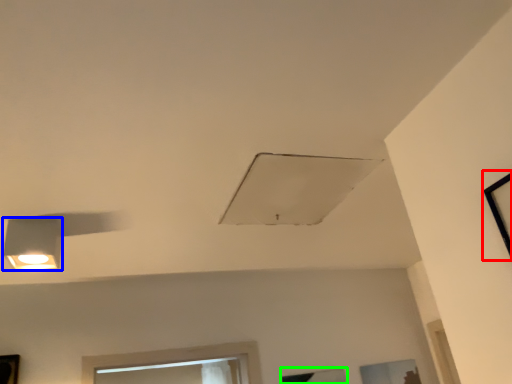
Question: Considering the real-world distances, which object is farthest from window (highlighted by a red box)? lamp (highlighted by a blue box) or window (highlighted by a green box)?

Choices:
 (A) lamp
 (B) window

Answer: (B)